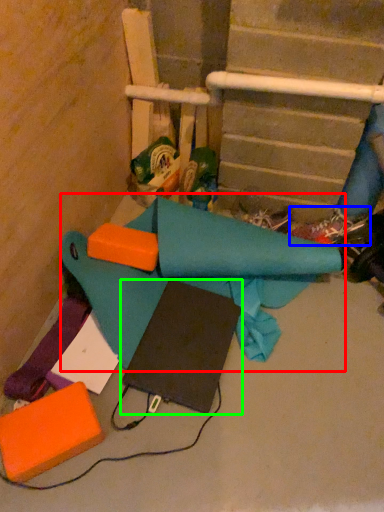
Question: Which object is the closest to the fabric (highlighted by a red box)? Choose among these: footwear (highlighted by a blue box) or notebook (highlighted by a green box).

Choices:
 (A) footwear
 (B) notebook

Answer: (B)